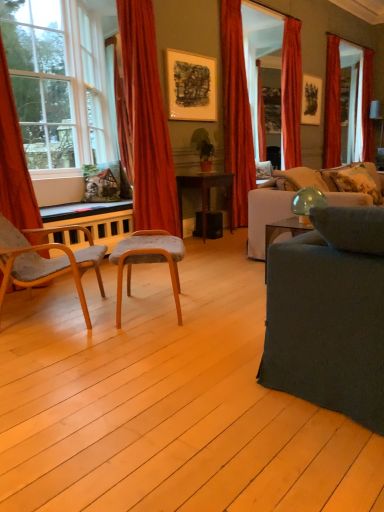
Where is `free space in front of gray fabric stool at center, which appears as the 1th chair when viewed from the right`? The image size is (384, 512). free space in front of gray fabric stool at center, which appears as the 1th chair when viewed from the right is located at coordinates (144, 344).